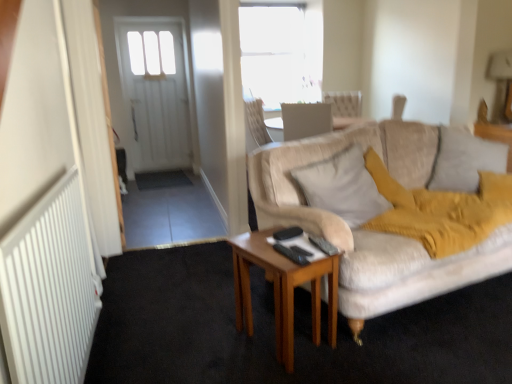
Question: Is the depth of black plastic remote control at center, which ranks as the third remote control in front-to-back order, greater than that of black plastic remote control at center, which is counted as the 2th remote control, starting from the front?

Choices:
 (A) yes
 (B) no

Answer: (A)

Question: Is black plastic remote control at center, which is counted as the first remote control, starting from the back, positioned before black plastic remote control at center, the 2th remote control in the back-to-front sequence?

Choices:
 (A) yes
 (B) no

Answer: (B)

Question: Is black plastic remote control at center, which ranks as the third remote control in front-to-back order, smaller than black plastic remote control at center, which is counted as the 2th remote control, starting from the front?

Choices:
 (A) no
 (B) yes

Answer: (A)

Question: From a real-world perspective, is black plastic remote control at center, which is counted as the first remote control, starting from the back, located beneath black plastic remote control at center, which is counted as the 2th remote control, starting from the front?

Choices:
 (A) no
 (B) yes

Answer: (A)

Question: Is black plastic remote control at center, which is counted as the first remote control, starting from the back, beside black plastic remote control at center, which is counted as the 2th remote control, starting from the front?

Choices:
 (A) yes
 (B) no

Answer: (B)

Question: Considering the positions of light beige fabric pillow at center, which is the second pillow from right to left, and black plastic remote control at center, which is counted as the 2th remote control, starting from the front, in the image, is light beige fabric pillow at center, which is the second pillow from right to left, bigger or smaller than black plastic remote control at center, which is counted as the 2th remote control, starting from the front,?

Choices:
 (A) big
 (B) small

Answer: (A)

Question: Considering their positions, is light beige fabric pillow at center, which is the second pillow from right to left, located in front of or behind black plastic remote control at center, the 2th remote control in the back-to-front sequence?

Choices:
 (A) behind
 (B) front

Answer: (A)

Question: From the image's perspective, relative to black plastic remote control at center, the 2th remote control in the back-to-front sequence, is light beige fabric pillow at center, arranged as the 1th pillow when viewed from the left, above or below?

Choices:
 (A) above
 (B) below

Answer: (A)

Question: In terms of height, does light beige fabric pillow at center, arranged as the 1th pillow when viewed from the left, look taller or shorter compared to black plastic remote control at center, the 2th remote control in the back-to-front sequence?

Choices:
 (A) short
 (B) tall

Answer: (B)

Question: In terms of width, does metallic gold lampshade at upper right look wider or thinner when compared to light beige fabric pillow at center, which is the second pillow from right to left?

Choices:
 (A) thin
 (B) wide

Answer: (A)

Question: From the image's perspective, is metallic gold lampshade at upper right positioned above or below light beige fabric pillow at center, which is the second pillow from right to left?

Choices:
 (A) below
 (B) above

Answer: (B)

Question: Is point (506, 64) closer or farther from the camera than point (333, 205)?

Choices:
 (A) farther
 (B) closer

Answer: (A)

Question: Looking at the image, does metallic gold lampshade at upper right seem bigger or smaller compared to light beige fabric pillow at center, which is the second pillow from right to left?

Choices:
 (A) big
 (B) small

Answer: (B)

Question: Considering their positions, is wooden table at center located in front of or behind black plastic remote control at center, which appears as the 3th remote control when viewed from the back?

Choices:
 (A) behind
 (B) front

Answer: (B)

Question: From a real-world perspective, is wooden table at center above or below black plastic remote control at center, which is the 1th remote control from front to back?

Choices:
 (A) above
 (B) below

Answer: (B)